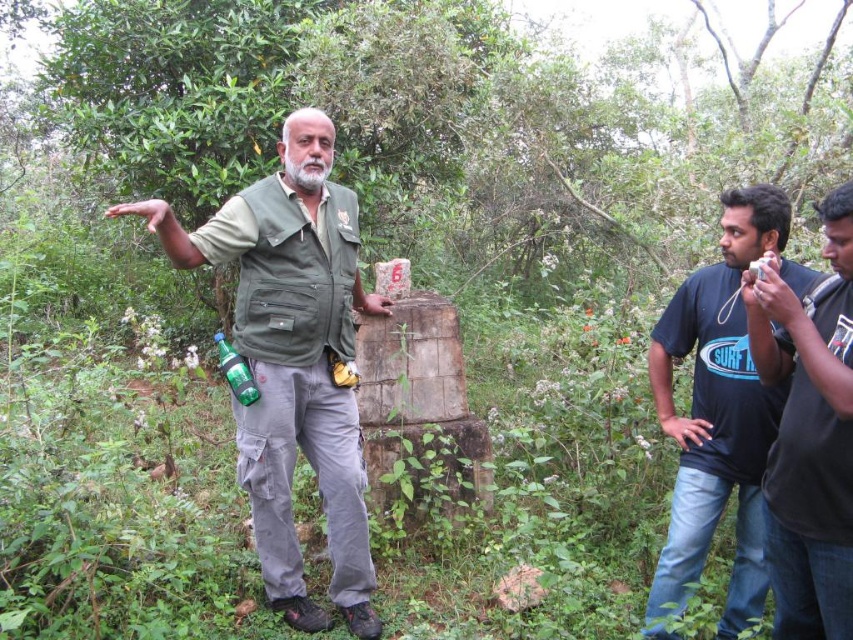
Question: Considering the real-world distances, which object is closest to the blue cotton t-shirt at right?

Choices:
 (A) dark blue t-shirt at right
 (B) green glass bottle at center
 (C) green matte vest at center

Answer: (A)

Question: Can you confirm if green matte vest at center is bigger than blue cotton t-shirt at right?

Choices:
 (A) yes
 (B) no

Answer: (A)

Question: Does green matte vest at center have a greater width compared to dark blue t-shirt at right?

Choices:
 (A) yes
 (B) no

Answer: (A)

Question: Among these points, which one is nearest to the camera?

Choices:
 (A) (798, 308)
 (B) (254, 394)
 (C) (770, 440)
 (D) (262, 241)

Answer: (A)

Question: Does dark blue t-shirt at right appear on the right side of green glass bottle at center?

Choices:
 (A) no
 (B) yes

Answer: (B)

Question: Which point appears farthest from the camera in this image?

Choices:
 (A) (837, 387)
 (B) (233, 406)
 (C) (740, 518)

Answer: (B)